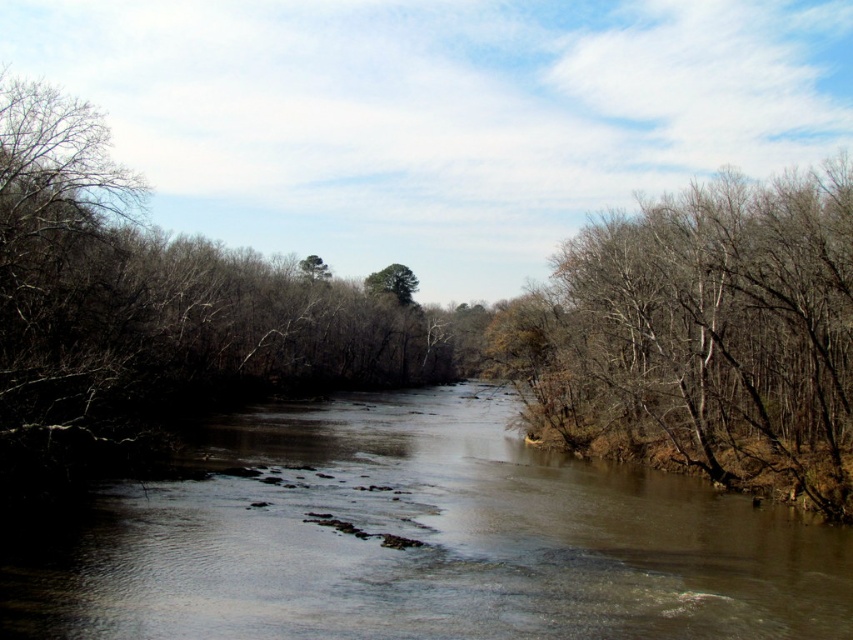
Question: In this image, where is brown leafless tree at right located relative to green leafy tree at center?

Choices:
 (A) right
 (B) left

Answer: (A)

Question: Which point is farther to the camera?

Choices:
 (A) brown muddy water at center
 (B) green leafy tree at center
 (C) brown leafless tree at right

Answer: (B)

Question: Is brown muddy water at center to the right of green leafy tree at center from the viewer's perspective?

Choices:
 (A) yes
 (B) no

Answer: (A)

Question: Which point appears closest to the camera in this image?

Choices:
 (A) (839, 477)
 (B) (520, 625)

Answer: (B)

Question: Is brown muddy water at center below green leafy tree at center?

Choices:
 (A) no
 (B) yes

Answer: (B)

Question: Considering the real-world distances, which object is farthest from the green leafy tree at center?

Choices:
 (A) brown leafless tree at right
 (B) brown muddy water at center

Answer: (B)